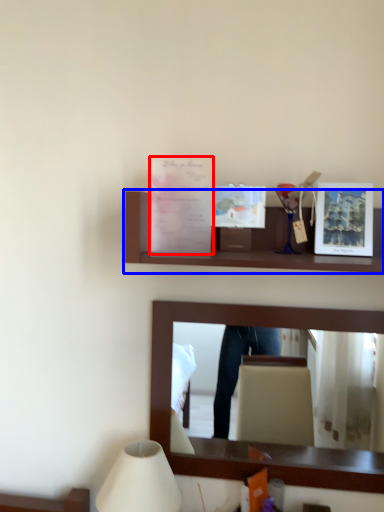
Question: Which point is closer to the camera, postcard (highlighted by a red box) or shelf (highlighted by a blue box)?

Choices:
 (A) postcard
 (B) shelf

Answer: (B)